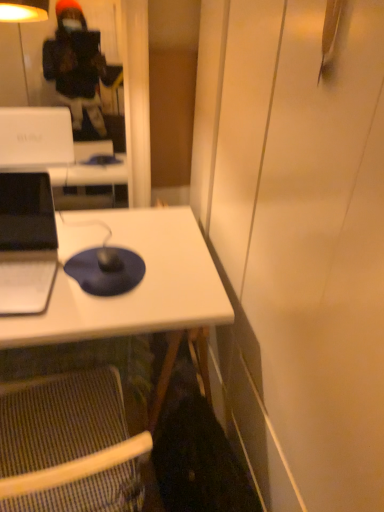
Question: Is white matte desk at center in front of or behind striped fabric folding chair at lower left in the image?

Choices:
 (A) front
 (B) behind

Answer: (B)

Question: Is point (124, 222) closer or farther from the camera than point (77, 482)?

Choices:
 (A) closer
 (B) farther

Answer: (B)

Question: Which of these objects is positioned closest to the white matte desk at center?

Choices:
 (A) matte black laptop at left
 (B) striped fabric folding chair at lower left
 (C) blue matte mousepad at center

Answer: (C)

Question: Considering the real-world distances, which object is closest to the white matte desk at center?

Choices:
 (A) blue matte mousepad at center
 (B) striped fabric folding chair at lower left
 (C) matte black laptop at left

Answer: (A)